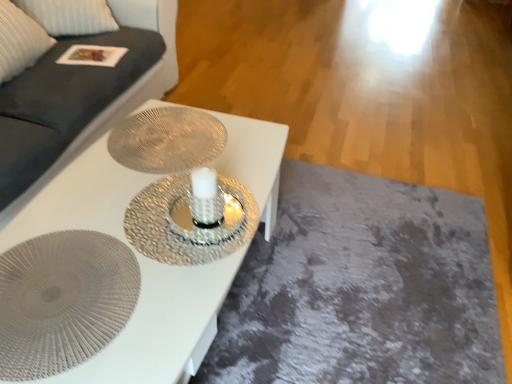
Find the location of a particular element. The width and height of the screenshot is (512, 384). free spot to the right of metallic textured plate at center, positioned as the 2th oval in bottom-to-top order is located at coordinates (251, 150).